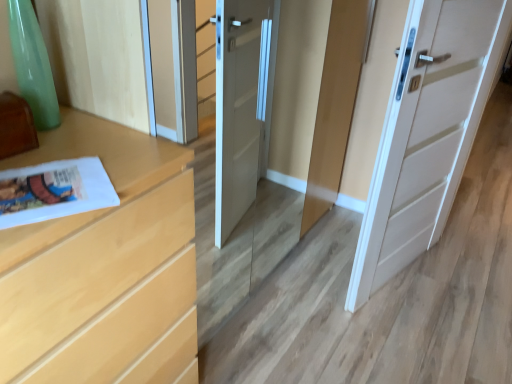
Question: From a real-world perspective, is white glossy magazine at lower left above or below light wood chest of drawers at left?

Choices:
 (A) below
 (B) above

Answer: (B)

Question: Considering the positions of white glossy magazine at lower left and light wood chest of drawers at left in the image, is white glossy magazine at lower left wider or thinner than light wood chest of drawers at left?

Choices:
 (A) thin
 (B) wide

Answer: (A)

Question: Estimate the real-world distances between objects in this image. Which object is closer to the white glossy magazine at lower left?

Choices:
 (A) white matte door at center
 (B) light wood chest of drawers at left

Answer: (B)

Question: Considering the real-world distances, which object is closest to the light wood chest of drawers at left?

Choices:
 (A) white glossy magazine at lower left
 (B) white matte door at center

Answer: (A)